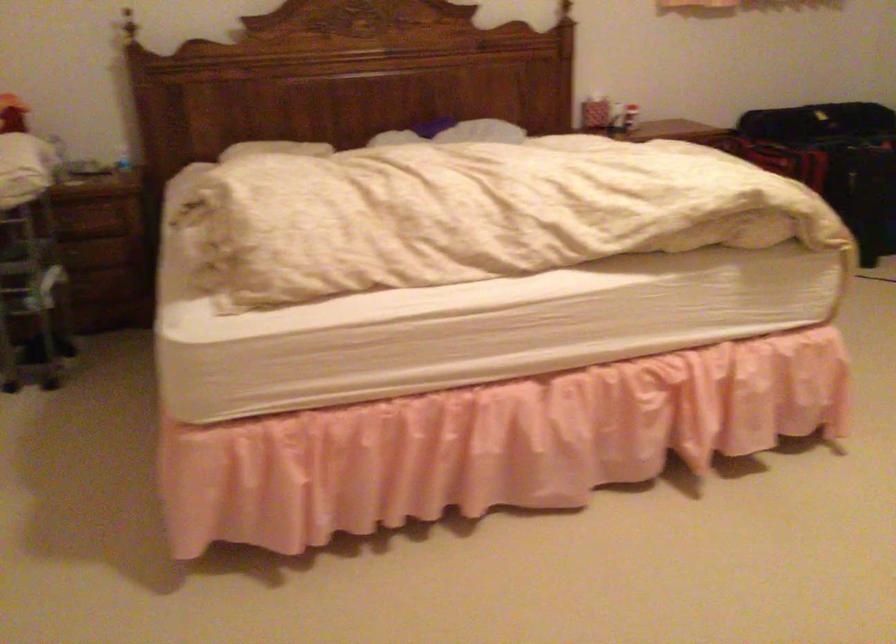
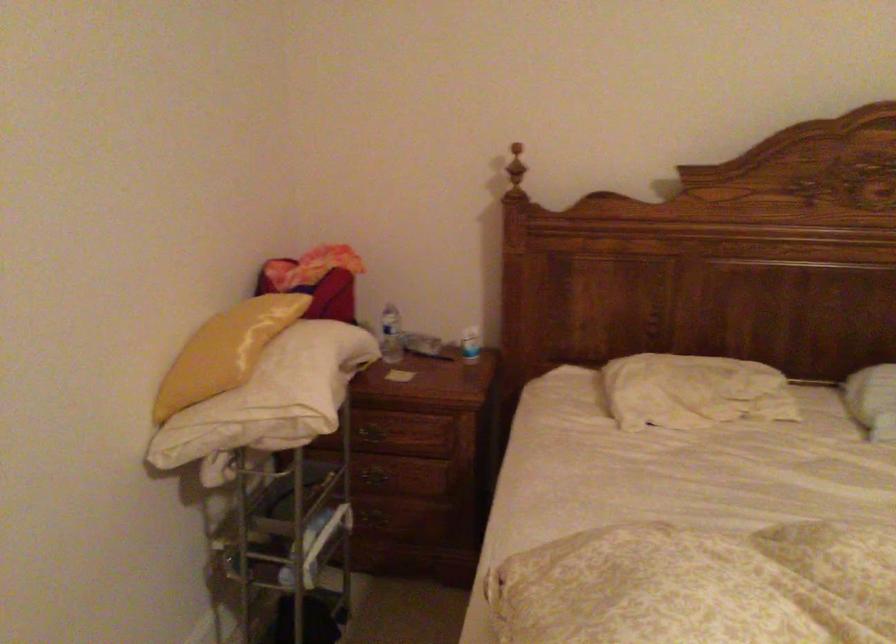
Question: I am providing you with two images of the same scene from different viewpoints. Please identify which objects are invisible in image2.

Choices:
 (A) green and white toothbrush
 (B) small white bottle
 (C) plastic water bottle
 (D) drawer handle

Answer: (C)